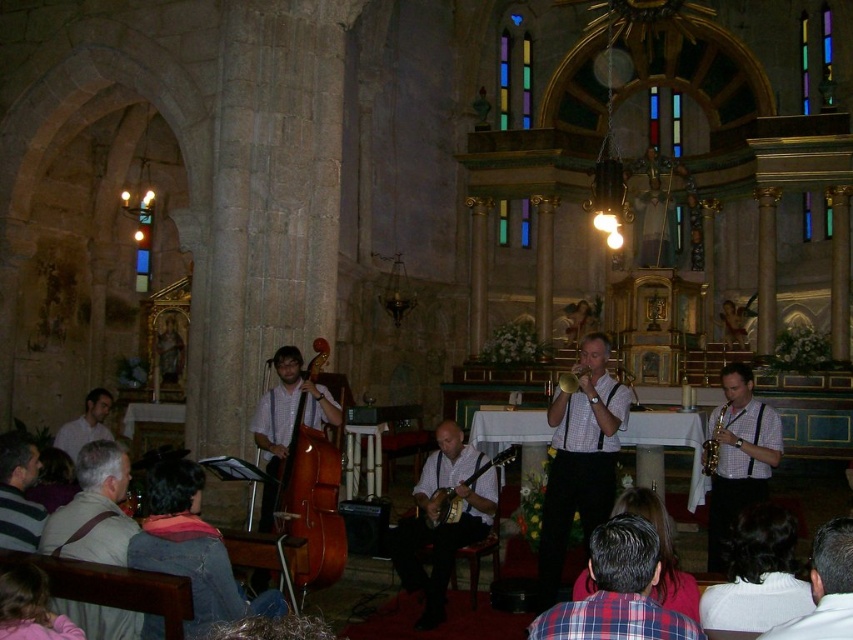
You are setting up a music stand for the banjo player and the guitar player. The stand can only hold instruments that are 10 cm thick or less. Based on the scene, will both the wooden banjo at center and the matte wood guitar at center fit on the stand?

The wooden banjo at center is thinner than the matte wood guitar at center. Since the stand can only hold instruments up to 10 cm thick, we need to know the exact thickness of the thicker instrument, which is the matte wood guitar at center. However, the description only states the banjo is thinner, not its exact measurement. Therefore, without knowing the exact thickness of the guitar, we cannot confirm if both will fit.

You are a photographer standing in the middle of the cathedral. You want to take a photo that includes both the gray fabric shirt at lower left and the matte wood guitar at center. Which object should you position closer to the edge of the frame to ensure both fit in the shot?

Since the gray fabric shirt at lower left is narrower than the matte wood guitar at center, you should position the wider matte wood guitar at center closer to the edge of the frame to ensure both fit within the shot.